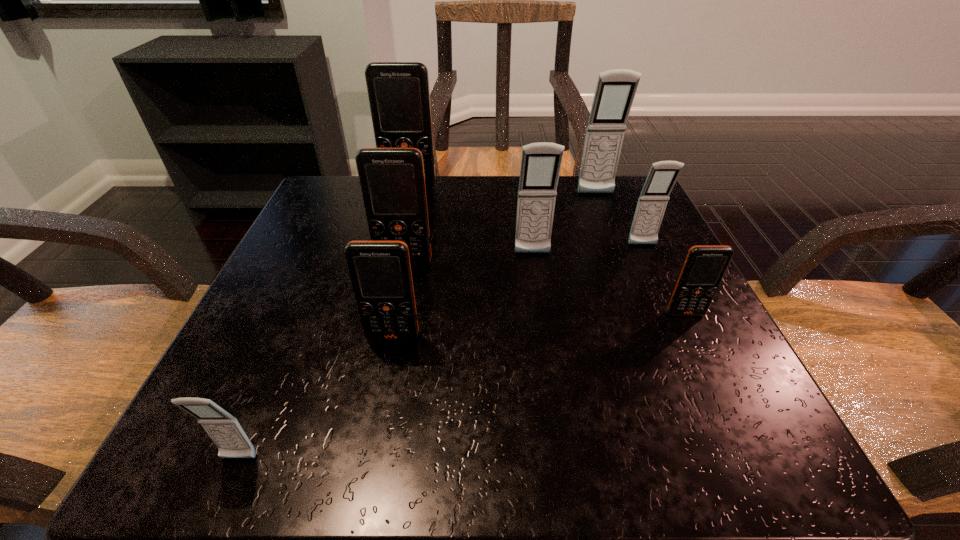
Where is `free spot at the far right corner of the desktop`? The image size is (960, 540). free spot at the far right corner of the desktop is located at coordinates (600, 199).

Locate an element on the screen. The width and height of the screenshot is (960, 540). vacant area at the near right corner is located at coordinates (732, 443).

Locate an element on the screen. The height and width of the screenshot is (540, 960). free space between the biggest gray cellular telephone and the sixth farthest cellular telephone is located at coordinates (640, 254).

Locate an element on the screen. vacant space that is in between the second smallest orange cellular telephone and the smallest gray cellular telephone is located at coordinates (316, 398).

At what (x,y) coordinates should I click in order to perform the action: click on blank region between the third nearest cellular telephone and the third nearest gray cellular telephone. Please return your answer as a coordinate pair (x, y). Looking at the image, I should click on (664, 279).

Identify the location of vacant area between the farthest gray cellular telephone and the second nearest orange cellular telephone. (640, 254).

Where is `vacant area that lies between the nearest cellular telephone and the second biggest orange cellular telephone`? vacant area that lies between the nearest cellular telephone and the second biggest orange cellular telephone is located at coordinates (322, 362).

Identify the location of free space between the third biggest gray cellular telephone and the second gray cellular telephone from left to right. (588, 249).

The height and width of the screenshot is (540, 960). I want to click on vacant region between the leftmost cellular telephone and the third farthest cellular telephone, so click(x=441, y=352).

At what (x,y) coordinates should I click in order to perform the action: click on object that is the sixth closest to the second smallest orange cellular telephone. Please return your answer as a coordinate pair (x, y). The image size is (960, 540). Looking at the image, I should click on (662, 176).